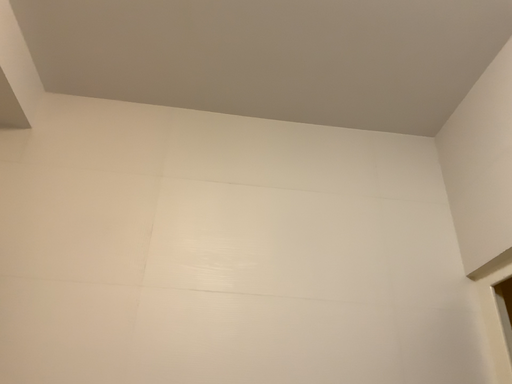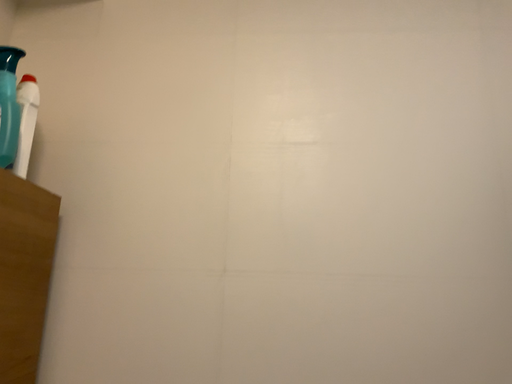
Question: How did the camera likely rotate when shooting the video?

Choices:
 (A) rotated right
 (B) rotated left

Answer: (B)